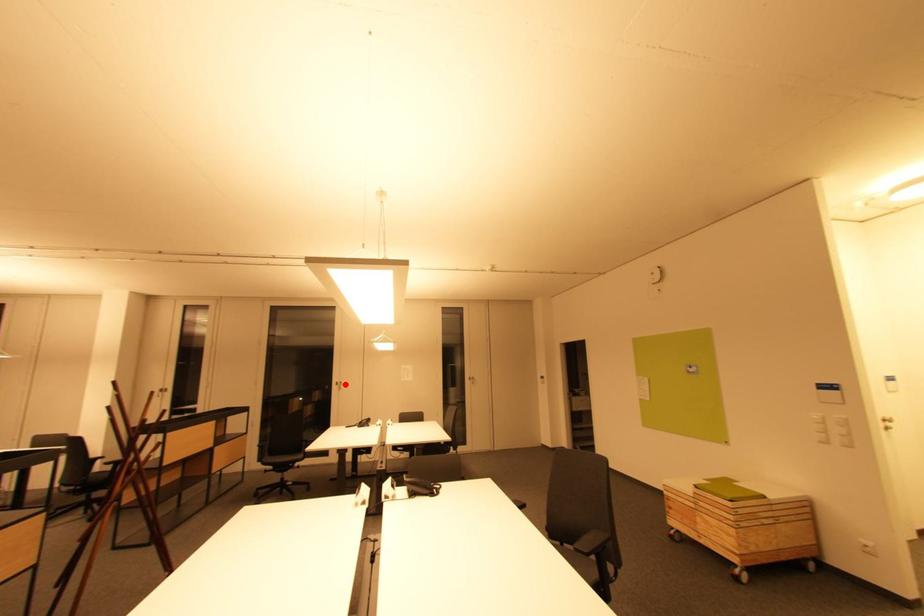
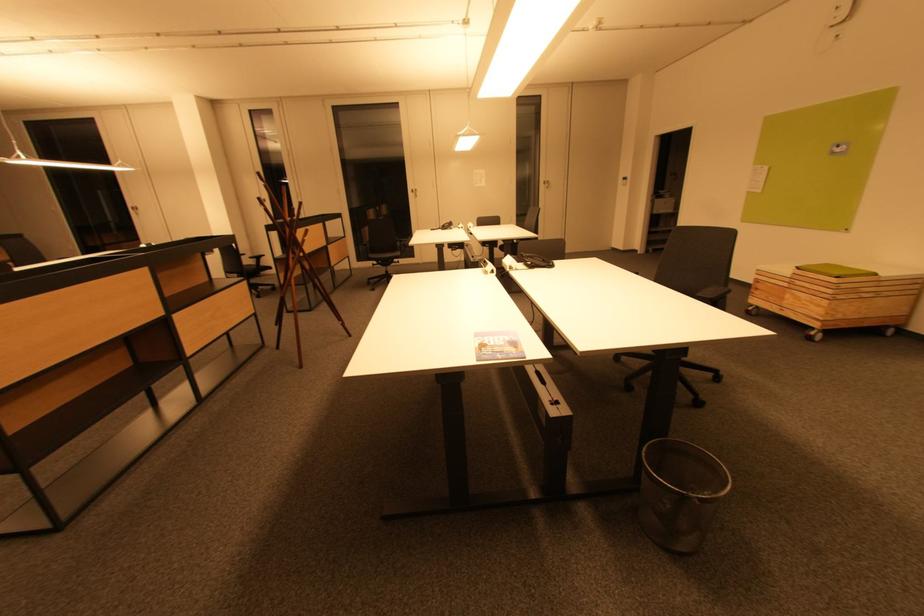
Question: A red point is marked in image1. In image2, is the corresponding 3D point closer to the camera or farther? Reply with the corresponding letter.

Choices:
 (A) The corresponding 3D point is closer.
 (B) The corresponding 3D point is farther.

Answer: (A)